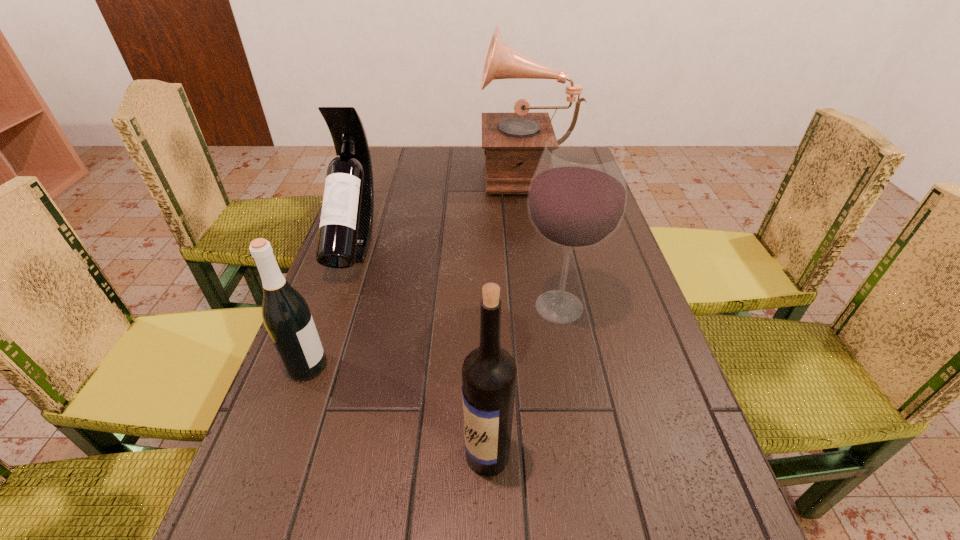
At what (x,y) coordinates should I click in order to perform the action: click on vacant space situated on the label of the nearest wine bottle. Please return your answer as a coordinate pair (x, y). This screenshot has width=960, height=540. Looking at the image, I should click on (260, 455).

Identify the location of free space located 0.050m on the label of the nearest wine bottle. (435, 455).

At what (x,y) coordinates should I click in order to perform the action: click on vacant space located 0.070m on the label of the nearest wine bottle. Please return your answer as a coordinate pair (x, y). The image size is (960, 540). Looking at the image, I should click on (x=422, y=455).

Identify the location of vacant space located on the stand of the farthest wine bottle. (291, 420).

Image resolution: width=960 pixels, height=540 pixels. Identify the location of free space located on the label of the second farthest wine bottle. (402, 366).

Identify the location of object that is positioned at the far edge. (513, 143).

Where is `record player located at the right edge`? This screenshot has height=540, width=960. record player located at the right edge is located at coordinates (513, 143).

This screenshot has height=540, width=960. I want to click on alcohol situated at the right edge, so click(x=577, y=197).

Locate an element on the screen. Image resolution: width=960 pixels, height=540 pixels. object that is at the far right corner is located at coordinates (513, 143).

The height and width of the screenshot is (540, 960). Find the location of `free location at the far edge of the desktop`. free location at the far edge of the desktop is located at coordinates (433, 163).